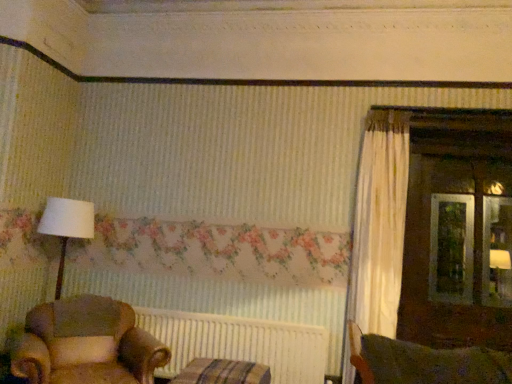
Question: From the image's perspective, is white ribbed radiator at center above or below striped fabric cushion at lower center?

Choices:
 (A) below
 (B) above

Answer: (B)

Question: Choose the correct answer: Is white ribbed radiator at center inside striped fabric cushion at lower center or outside it?

Choices:
 (A) inside
 (B) outside

Answer: (B)

Question: Estimate the real-world distances between objects in this image. Which object is farther from the leather armchair at lower left?

Choices:
 (A) white ribbed radiator at center
 (B) striped fabric cushion at lower center

Answer: (A)

Question: Which object is the closest to the leather armchair at lower left?

Choices:
 (A) white ribbed radiator at center
 (B) striped fabric cushion at lower center

Answer: (B)